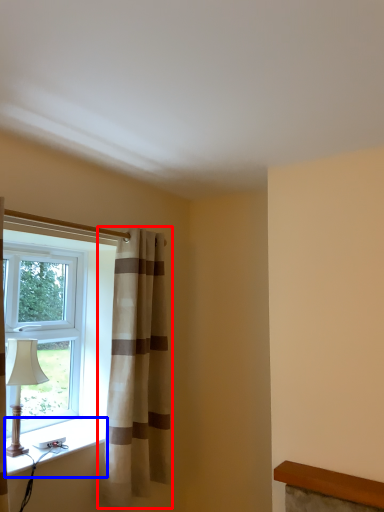
Question: Which point is further to the camera, curtain (highlighted by a red box) or window sill (highlighted by a blue box)?

Choices:
 (A) curtain
 (B) window sill

Answer: (A)